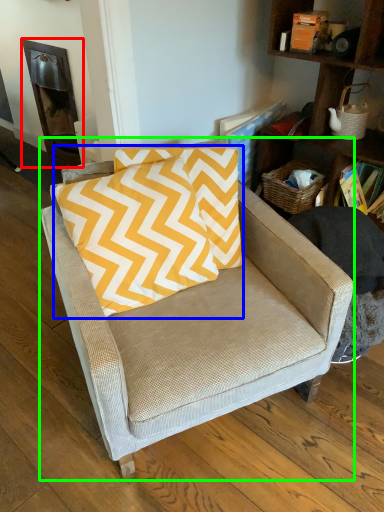
Question: Estimate the real-world distances between objects in this image. Which object is closer to fireplace (highlighted by a red box), pillow (highlighted by a blue box) or chair (highlighted by a green box)?

Choices:
 (A) pillow
 (B) chair

Answer: (A)